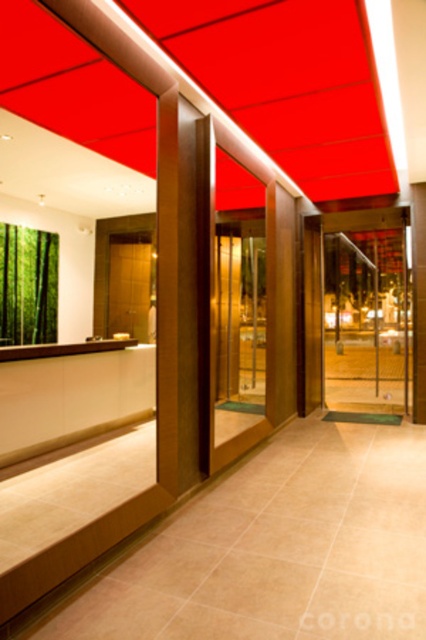
Question: Does transparent glass door at center appear over green bamboo curtain at left?

Choices:
 (A) yes
 (B) no

Answer: (B)

Question: Does matte red ceiling at upper center appear on the left side of transparent glass door at center?

Choices:
 (A) no
 (B) yes

Answer: (B)

Question: Estimate the real-world distances between objects in this image. Which object is farther from the matte red ceiling at upper center?

Choices:
 (A) wooden pillar at center
 (B) transparent glass door at center
 (C) green bamboo curtain at left

Answer: (B)

Question: Is matte red ceiling at upper center positioned at the back of wooden pillar at center?

Choices:
 (A) yes
 (B) no

Answer: (B)

Question: Which object is the farthest from the transparent glass door at center?

Choices:
 (A) green bamboo curtain at left
 (B) wooden pillar at center

Answer: (B)

Question: Estimate the real-world distances between objects in this image. Which object is farther from the matte red ceiling at upper center?

Choices:
 (A) wooden pillar at center
 (B) green bamboo curtain at left

Answer: (B)